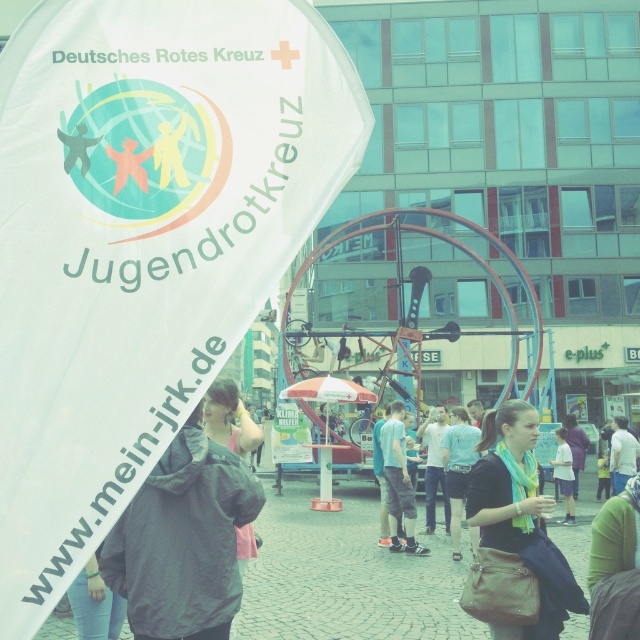
Can you confirm if teal scarf at center is shorter than light blue scarf at center?

No.

Who is more forward, (524, 429) or (560, 465)?

Positioned in front is point (524, 429).

Who is more distant from viewer, [512,468] or [570,499]?

Point [570,499]

You are a GUI agent. You are given a task and a screenshot of the screen. Output one action in this format:
    pyautogui.click(x=<x>, y=<y>)
    Task: Click on the teal scarf at center
    The height and width of the screenshot is (640, 640).
    Given the screenshot: What is the action you would take?
    pyautogui.click(x=516, y=513)

Between white fabric banner at upper left and teal scarf at center, which one is positioned higher?

white fabric banner at upper left is above.

Which is in front, point (120, 109) or point (522, 429)?

Positioned in front is point (120, 109).

Locate an element on the screen. Image resolution: width=640 pixels, height=640 pixels. white fabric banner at upper left is located at coordinates (141, 241).

Between white fabric banner at upper left and light blue scarf at center, which one is positioned higher?

white fabric banner at upper left is above.

Does point (276, 148) come farther from viewer compared to point (566, 456)?

No, it is not.

Between point (72, 193) and point (572, 474), which one is positioned behind?

The point (572, 474) is more distant.

Where is `white fabric banner at upper left`? The width and height of the screenshot is (640, 640). white fabric banner at upper left is located at coordinates (141, 241).